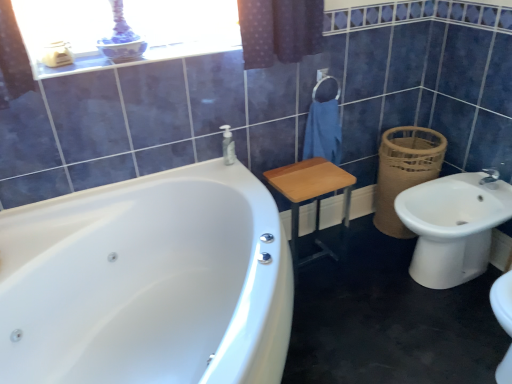
Where is `vacant position to the left of clear plastic soap dispenser at upper center`? The width and height of the screenshot is (512, 384). vacant position to the left of clear plastic soap dispenser at upper center is located at coordinates (201, 167).